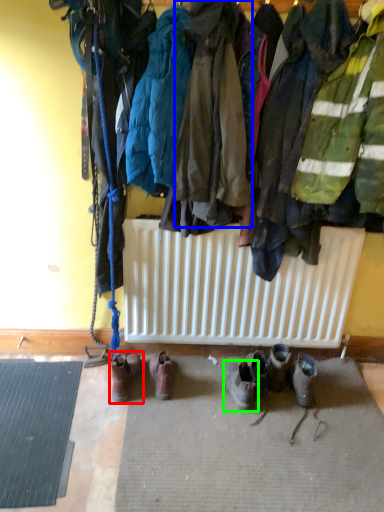
Question: Which object is the closest to the footwear (highlighted by a red box)? Choose among these: jacket (highlighted by a blue box) or footwear (highlighted by a green box).

Choices:
 (A) jacket
 (B) footwear

Answer: (B)